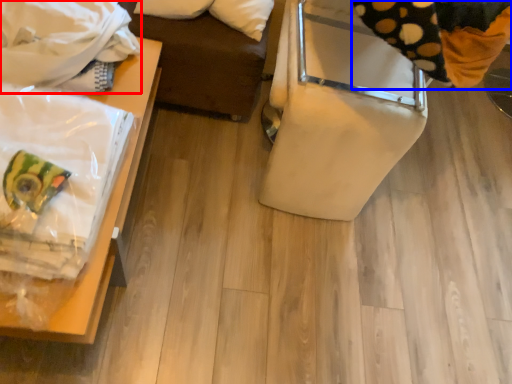
Question: Among these objects, which one is farthest to the camera, blanket (highlighted by a red box) or material (highlighted by a blue box)?

Choices:
 (A) blanket
 (B) material

Answer: (A)